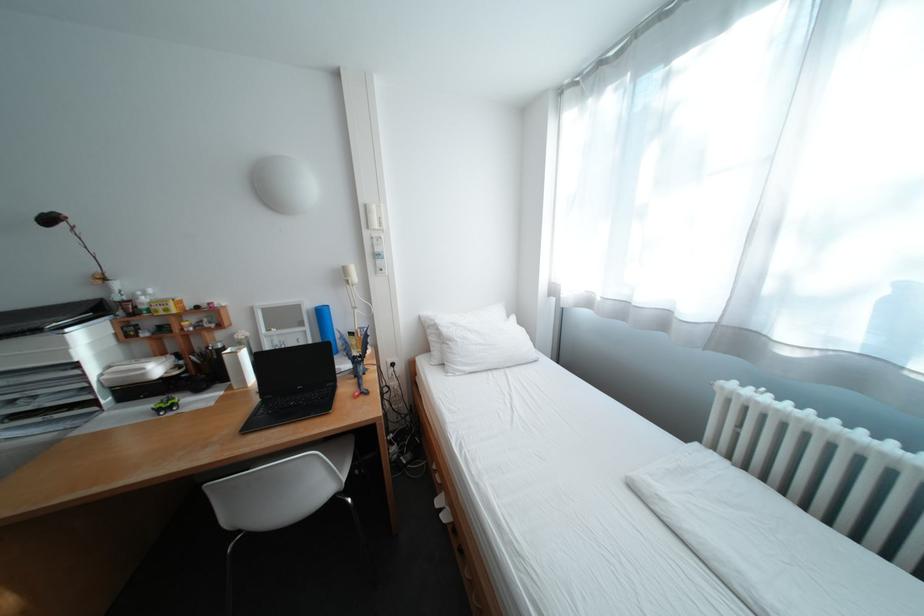
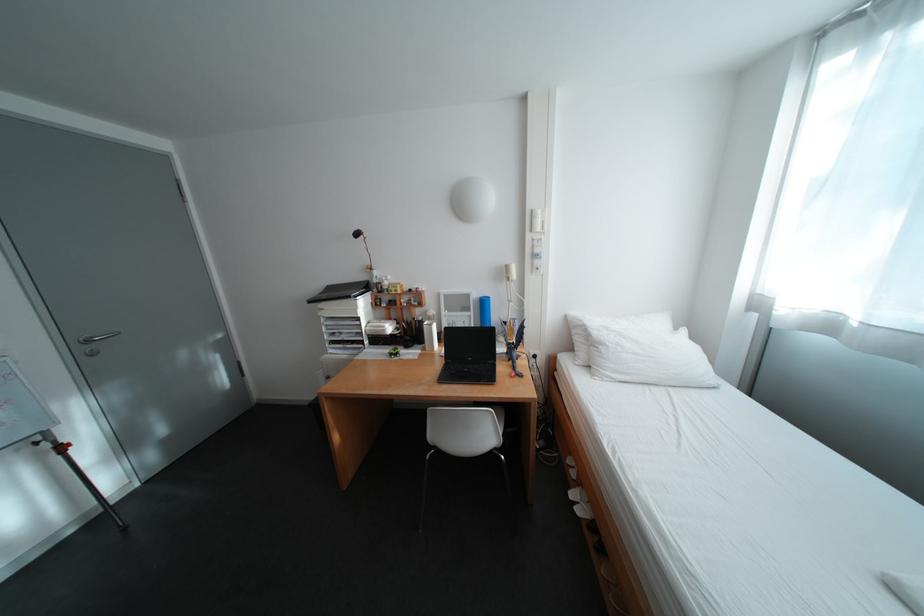
Where in the second image is the point corresponding to point (320, 329) from the first image?

(484, 314)